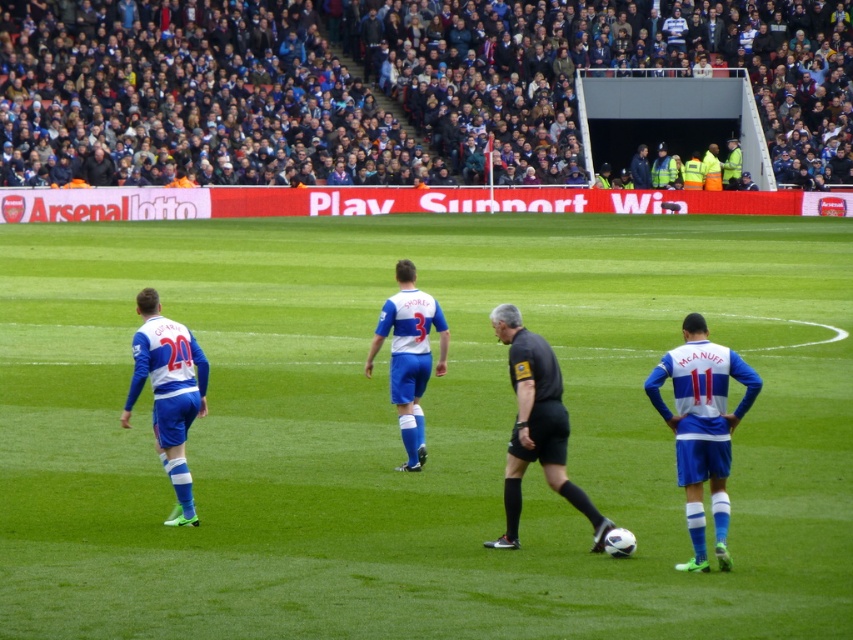
Question: Which of the following is the closest to the observer?

Choices:
 (A) blue/white jersey at center
 (B) blue fabric jersey at center
 (C) black matte referee at center

Answer: (C)

Question: Which object is positioned closest to the blue jersey at right?

Choices:
 (A) blue fabric jersey at center
 (B) black matte referee at center

Answer: (B)

Question: Is the position of blue jersey at right more distant than that of black matte referee at center?

Choices:
 (A) yes
 (B) no

Answer: (B)

Question: Which of these objects is positioned farthest from the white matte jersey at center?

Choices:
 (A) blue jersey at right
 (B) black matte referee at center
 (C) blue fabric jersey at center

Answer: (A)

Question: Does blue/white jersey at center have a smaller size compared to blue jersey at right?

Choices:
 (A) yes
 (B) no

Answer: (B)

Question: Is blue jersey at right bigger than white matte jersey at center?

Choices:
 (A) no
 (B) yes

Answer: (A)